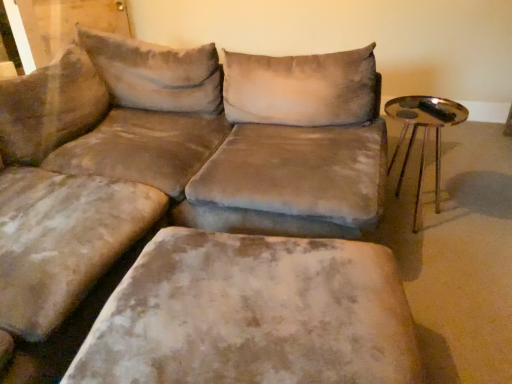
I want to click on free space above shiny metallic tray at right (from a real-world perspective), so pyautogui.click(x=431, y=106).